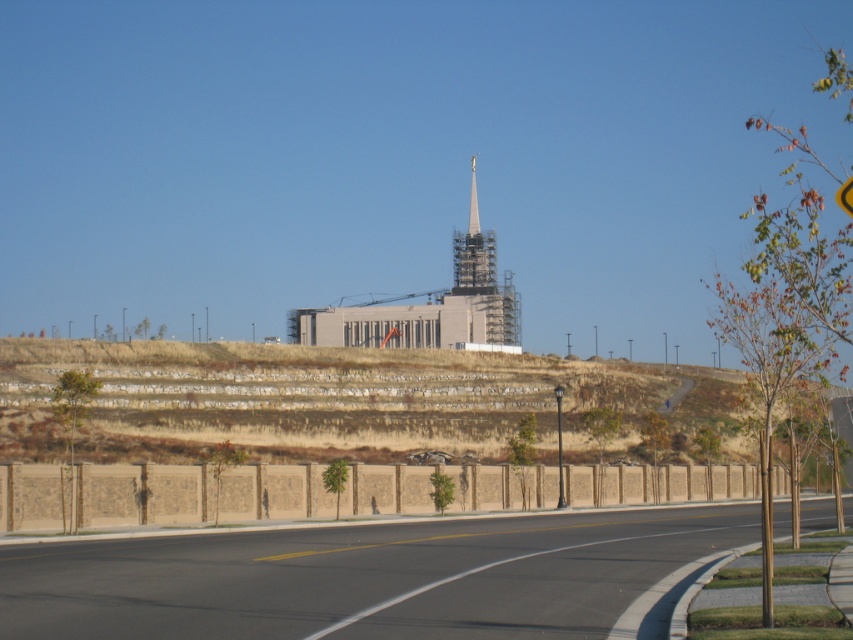
Does asphalt road at center appear under yellow plastic triangle at upper center?

Indeed, asphalt road at center is positioned under yellow plastic triangle at upper center.

Which is more to the right, asphalt road at center or yellow plastic triangle at upper center?

From the viewer's perspective, yellow plastic triangle at upper center appears more on the right side.

Does point (378, 564) come closer to viewer compared to point (837, 192)?

That is True.

Identify the location of asphalt road at center. Image resolution: width=853 pixels, height=640 pixels. (363, 577).

Does point (605, 394) come closer to viewer compared to point (844, 202)?

That is False.

Does brown textured hillside at center have a lesser height compared to yellow plastic triangle at upper center?

Indeed, brown textured hillside at center has a lesser height compared to yellow plastic triangle at upper center.

Identify the location of brown textured hillside at center. The width and height of the screenshot is (853, 640). (345, 401).

Does white metallic spire at center have a lesser height compared to yellow plastic triangle at upper center?

No, white metallic spire at center is not shorter than yellow plastic triangle at upper center.

Identify the location of white metallic spire at center. The image size is (853, 640). (485, 278).

The image size is (853, 640). Identify the location of white metallic spire at center. (485, 278).